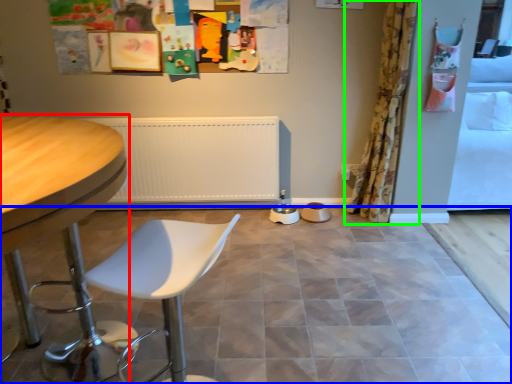
Question: Which object is positioned farthest from table (highlighted by a red box)? Select from ceramic tile (highlighted by a blue box) and curtain (highlighted by a green box).

Choices:
 (A) ceramic tile
 (B) curtain

Answer: (B)